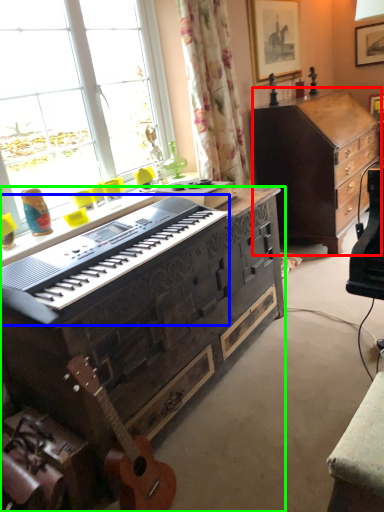
Question: Based on their relative distances, which object is farther from cabinetry (highlighted by a red box)? Choose from piano (highlighted by a blue box) and desk (highlighted by a green box).

Choices:
 (A) piano
 (B) desk

Answer: (A)